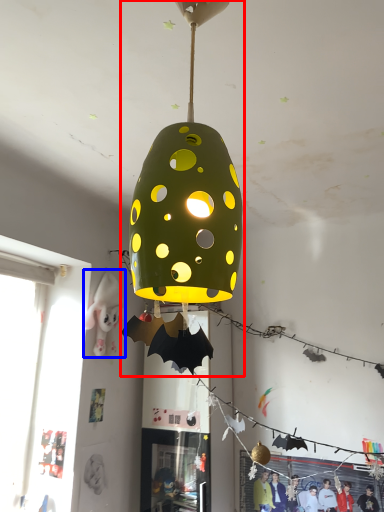
Question: Among these objects, which one is farthest to the camera, lamp (highlighted by a red box) or person (highlighted by a blue box)?

Choices:
 (A) lamp
 (B) person

Answer: (B)